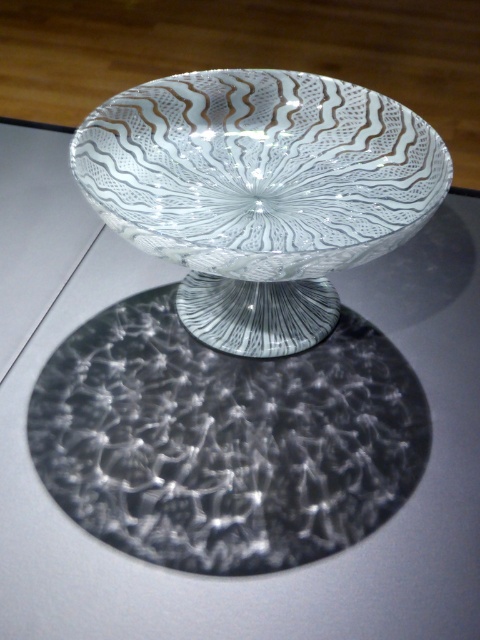
Question: Observing the image, what is the correct spatial positioning of transparent textured glass plate at center in reference to transparent glass bowl at center?

Choices:
 (A) below
 (B) above

Answer: (A)

Question: Is transparent textured glass plate at center positioned at the back of transparent glass bowl at center?

Choices:
 (A) no
 (B) yes

Answer: (B)

Question: Among these points, which one is farthest from the camera?

Choices:
 (A) (271, 420)
 (B) (324, 156)

Answer: (B)

Question: Which point is farther to the camera?

Choices:
 (A) transparent glass bowl at center
 (B) transparent textured glass plate at center

Answer: (B)

Question: Can you confirm if transparent textured glass plate at center is positioned below transparent glass bowl at center?

Choices:
 (A) yes
 (B) no

Answer: (A)

Question: Which object is closer to the camera taking this photo?

Choices:
 (A) transparent textured glass plate at center
 (B) transparent glass bowl at center

Answer: (B)